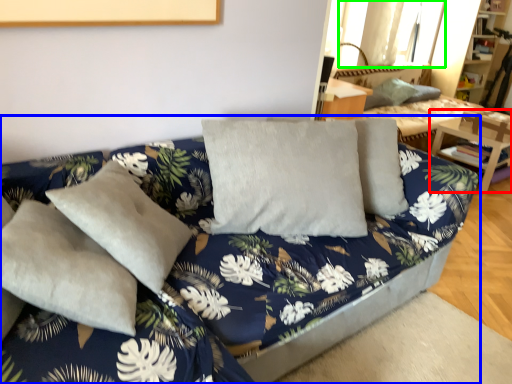
Question: Based on their relative distances, which object is farther from table (highlighted by a red box)? Choose from studio couch (highlighted by a blue box) and window (highlighted by a green box).

Choices:
 (A) studio couch
 (B) window

Answer: (A)